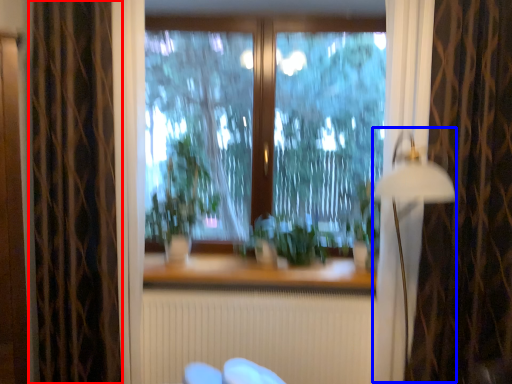
Question: Among these objects, which one is farthest to the camera, curtain (highlighted by a red box) or lamp (highlighted by a blue box)?

Choices:
 (A) curtain
 (B) lamp

Answer: (A)